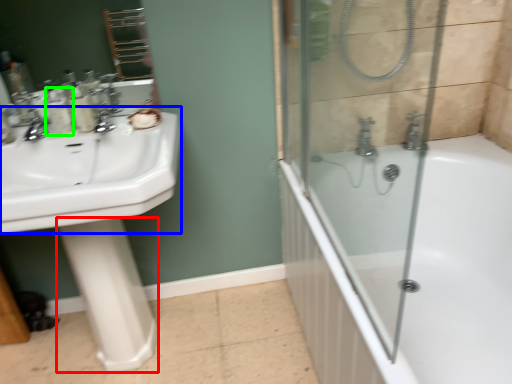
Question: Which is nearer to the bidet (highlighted by a red box)? counter top (highlighted by a blue box) or toiletry (highlighted by a green box).

Choices:
 (A) counter top
 (B) toiletry

Answer: (A)